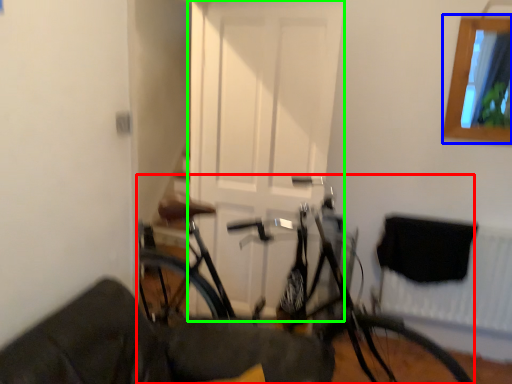
Question: Which object is the closest to the bicycle (highlighted by a red box)? Choose among these: window (highlighted by a blue box) or door (highlighted by a green box).

Choices:
 (A) window
 (B) door

Answer: (B)